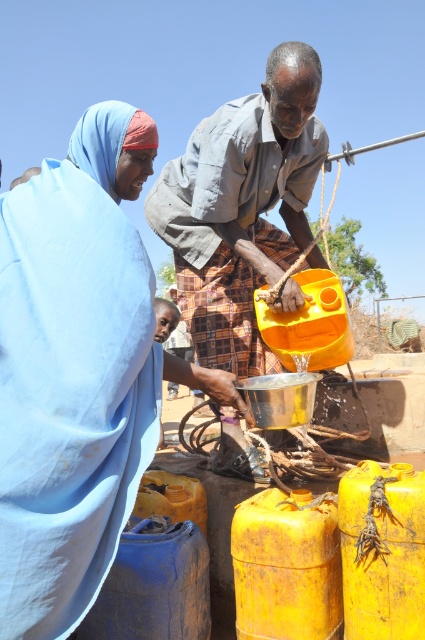
Is point (206, 273) behind point (252, 598)?

Yes, point (206, 273) is farther from viewer.

Can you confirm if matte gray shirt at center is shorter than rusty yellow barrel at center?

No, matte gray shirt at center is not shorter than rusty yellow barrel at center.

Does point (198, 140) come farther from viewer compared to point (257, 563)?

Yes, point (198, 140) is behind point (257, 563).

I want to click on matte gray shirt at center, so click(x=241, y=208).

Who is higher up, blue fabric at center or yellow matte barrel at lower center?

blue fabric at center is higher up.

Between blue fabric at center and yellow matte barrel at lower center, which one appears on the left side from the viewer's perspective?

Positioned to the left is blue fabric at center.

Is point (5, 310) less distant than point (374, 620)?

Yes, it is in front of point (374, 620).

Locate an element on the screen. This screenshot has width=425, height=640. blue fabric at center is located at coordinates (78, 371).

Is point (289, 243) behind point (306, 324)?

Yes, point (289, 243) is behind point (306, 324).

Based on the photo, can you confirm if matte gray shirt at center is shorter than yellow matte plastic barrel at center?

Incorrect, matte gray shirt at center's height does not fall short of yellow matte plastic barrel at center's.

Locate an element on the screen. matte gray shirt at center is located at coordinates (241, 208).

At what (x,y) coordinates should I click in order to perform the action: click on matte gray shirt at center. Please return your answer as a coordinate pair (x, y). Image resolution: width=425 pixels, height=640 pixels. Looking at the image, I should click on (241, 208).